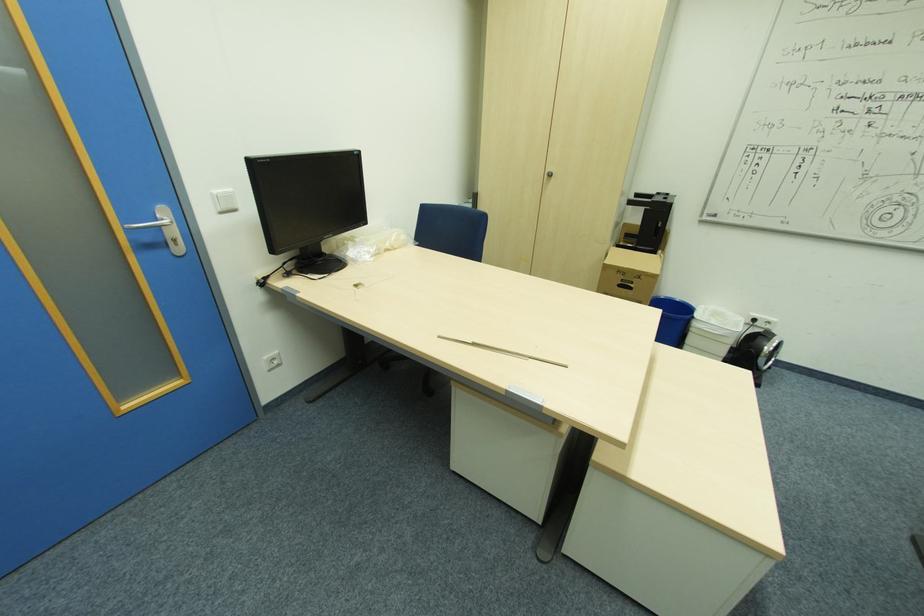
Find where to pull the cabinet door handle. Please return your answer as a coordinate pair (x, y).

(549, 174)